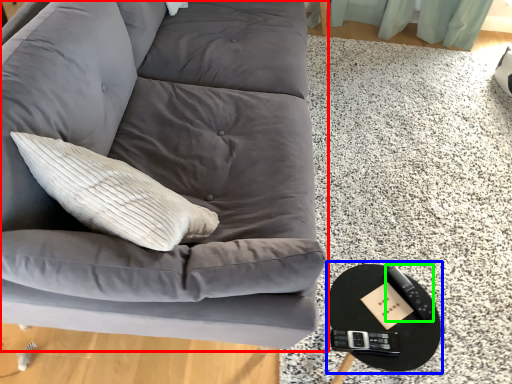
Question: Considering the real-world distances, which object is closest to studio couch (highlighted by a red box)? round table (highlighted by a blue box) or remote (highlighted by a green box).

Choices:
 (A) round table
 (B) remote

Answer: (A)